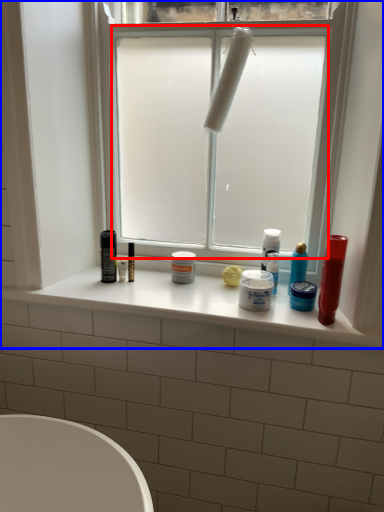
Question: Which point is further to the camera, window screen (highlighted by a red box) or window (highlighted by a blue box)?

Choices:
 (A) window screen
 (B) window

Answer: (A)